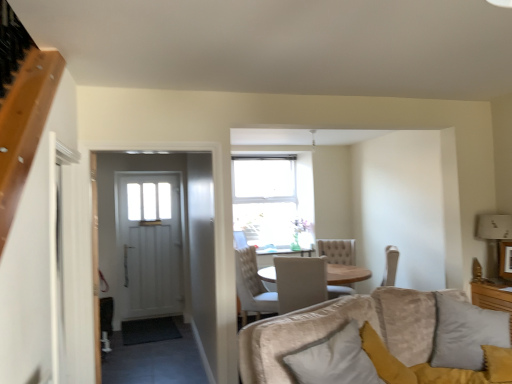
Image resolution: width=512 pixels, height=384 pixels. What do you see at coordinates (334, 360) in the screenshot? I see `white soft pillow at lower right, marked as the 1th pillow in a left-to-right arrangement` at bounding box center [334, 360].

Image resolution: width=512 pixels, height=384 pixels. In order to click on velvet gray pillow at lower right, which ranks as the first pillow in right-to-left order in this screenshot , I will do `click(466, 333)`.

From the image's perspective, which one is positioned lower, white soft pillow at lower right, the second pillow positioned from the right, or white fabric lampshade at upper right?

From the image's view, white soft pillow at lower right, the second pillow positioned from the right, is below.

Who is shorter, white soft pillow at lower right, marked as the 1th pillow in a left-to-right arrangement, or white fabric lampshade at upper right?

With less height is white soft pillow at lower right, marked as the 1th pillow in a left-to-right arrangement.

Is point (329, 358) positioned before point (480, 235)?

Yes.

Could you tell me if white soft pillow at lower right, the second pillow positioned from the right, is turned towards white fabric lampshade at upper right?

No, white soft pillow at lower right, the second pillow positioned from the right, does not turn towards white fabric lampshade at upper right.

From the picture: Which object is positioned more to the right, velvet gray pillow at lower right, which ranks as the 2th pillow in left-to-right order, or white fabric lampshade at upper right?

white fabric lampshade at upper right is more to the right.

How different are the orientations of velvet gray pillow at lower right, which ranks as the 2th pillow in left-to-right order, and white fabric lampshade at upper right in degrees?

The angle between the facing direction of velvet gray pillow at lower right, which ranks as the 2th pillow in left-to-right order, and the facing direction of white fabric lampshade at upper right is 56.8 degrees.

Is point (436, 331) closer or farther from the camera than point (502, 218)?

Point (436, 331) is positioned closer to the camera compared to point (502, 218).

Considering their positions, is velvet gray pillow at lower right, which ranks as the first pillow in right-to-left order, located in front of or behind white fabric lampshade at upper right?

Visually, velvet gray pillow at lower right, which ranks as the first pillow in right-to-left order, is located in front of white fabric lampshade at upper right.

Is velvet gray pillow at lower right, which ranks as the first pillow in right-to-left order, positioned with its back to beige fabric chair at center?

velvet gray pillow at lower right, which ranks as the first pillow in right-to-left order, is not turned away from beige fabric chair at center.

Between velvet gray pillow at lower right, which ranks as the 2th pillow in left-to-right order, and beige fabric chair at center, which one has smaller size?

velvet gray pillow at lower right, which ranks as the 2th pillow in left-to-right order.

From a real-world perspective, between velvet gray pillow at lower right, which ranks as the 2th pillow in left-to-right order, and beige fabric chair at center, who is vertically higher?

In real-world perspective, velvet gray pillow at lower right, which ranks as the 2th pillow in left-to-right order, is above.

Can you tell me how much velvet gray pillow at lower right, which ranks as the first pillow in right-to-left order, and beige fabric chair at center differ in facing direction?

The angle between the facing direction of velvet gray pillow at lower right, which ranks as the first pillow in right-to-left order, and the facing direction of beige fabric chair at center is 87 degrees.

Can you confirm if beige fabric chair at center is smaller than velvet gray pillow at lower right, which ranks as the first pillow in right-to-left order?

Actually, beige fabric chair at center might be larger than velvet gray pillow at lower right, which ranks as the first pillow in right-to-left order.

Is there a large distance between beige fabric chair at center and velvet gray pillow at lower right, which ranks as the 2th pillow in left-to-right order?

beige fabric chair at center is positioned a significant distance from velvet gray pillow at lower right, which ranks as the 2th pillow in left-to-right order.

Locate an element on the screen. The width and height of the screenshot is (512, 384). pillow that is the 2nd object above the beige fabric chair at center (from a real-world perspective) is located at coordinates tap(466, 333).

From a real-world perspective, relative to velvet gray pillow at lower right, which ranks as the 2th pillow in left-to-right order, is beige fabric chair at center vertically above or below?

In terms of real-world spatial position, beige fabric chair at center is below velvet gray pillow at lower right, which ranks as the 2th pillow in left-to-right order.

Could you tell me if white soft pillow at lower right, the second pillow positioned from the right, is facing beige fabric chair at center?

No, white soft pillow at lower right, the second pillow positioned from the right, is not facing towards beige fabric chair at center.

From a real-world perspective, between white soft pillow at lower right, the second pillow positioned from the right, and beige fabric chair at center, who is vertically lower?

beige fabric chair at center is physically lower.

Which of these two, white soft pillow at lower right, marked as the 1th pillow in a left-to-right arrangement, or beige fabric chair at center, is thinner?

white soft pillow at lower right, marked as the 1th pillow in a left-to-right arrangement, is thinner.

From a real-world perspective, relative to white soft pillow at lower right, the second pillow positioned from the right, is white fabric lampshade at upper right vertically above or below?

Clearly, from a real-world perspective, white fabric lampshade at upper right is above white soft pillow at lower right, the second pillow positioned from the right.

Does white fabric lampshade at upper right lie in front of white soft pillow at lower right, marked as the 1th pillow in a left-to-right arrangement?

No, white fabric lampshade at upper right is further to the viewer.

What's the angular difference between white fabric lampshade at upper right and white soft pillow at lower right, marked as the 1th pillow in a left-to-right arrangement,'s facing directions?

white fabric lampshade at upper right and white soft pillow at lower right, marked as the 1th pillow in a left-to-right arrangement, are facing 113 degrees away from each other.

Is white soft pillow at lower right, the second pillow positioned from the right, completely or partially inside white fabric lampshade at upper right?

No, white soft pillow at lower right, the second pillow positioned from the right, is not a part of white fabric lampshade at upper right.

From the picture: Considering the sizes of white soft pillow at lower right, marked as the 1th pillow in a left-to-right arrangement, and velvet gray pillow at lower right, which ranks as the first pillow in right-to-left order, in the image, is white soft pillow at lower right, marked as the 1th pillow in a left-to-right arrangement, bigger or smaller than velvet gray pillow at lower right, which ranks as the first pillow in right-to-left order,?

Considering their sizes, white soft pillow at lower right, marked as the 1th pillow in a left-to-right arrangement, takes up less space than velvet gray pillow at lower right, which ranks as the first pillow in right-to-left order.

Based on the photo, is white soft pillow at lower right, marked as the 1th pillow in a left-to-right arrangement, at the right side of velvet gray pillow at lower right, which ranks as the first pillow in right-to-left order?

No.

Is white soft pillow at lower right, marked as the 1th pillow in a left-to-right arrangement, in front of velvet gray pillow at lower right, which ranks as the 2th pillow in left-to-right order?

That is True.

This screenshot has height=384, width=512. In order to click on lamp that appears above the white soft pillow at lower right, the second pillow positioned from the right (from a real-world perspective) in this screenshot , I will do `click(495, 227)`.

Where is `lamp on the right of the velvet gray pillow at lower right, which ranks as the 2th pillow in left-to-right order`? This screenshot has width=512, height=384. lamp on the right of the velvet gray pillow at lower right, which ranks as the 2th pillow in left-to-right order is located at coordinates (495, 227).

Consider the image. Based on their spatial positions, is white soft pillow at lower right, marked as the 1th pillow in a left-to-right arrangement, or velvet gray pillow at lower right, which ranks as the 2th pillow in left-to-right order, closer to beige fabric chair at center?

velvet gray pillow at lower right, which ranks as the 2th pillow in left-to-right order, is positioned closer to the anchor beige fabric chair at center.

Which object lies further to the anchor point beige fabric chair at center, velvet gray pillow at lower right, which ranks as the first pillow in right-to-left order, or white soft pillow at lower right, marked as the 1th pillow in a left-to-right arrangement?

Among the two, white soft pillow at lower right, marked as the 1th pillow in a left-to-right arrangement, is located further to beige fabric chair at center.

Considering their positions, is beige fabric chair at center positioned closer to velvet gray pillow at lower right, which ranks as the 2th pillow in left-to-right order, than white soft pillow at lower right, the second pillow positioned from the right?

Among the two, white soft pillow at lower right, the second pillow positioned from the right, is located nearer to velvet gray pillow at lower right, which ranks as the 2th pillow in left-to-right order.

From the image, which object appears to be nearer to white soft pillow at lower right, the second pillow positioned from the right, velvet gray pillow at lower right, which ranks as the first pillow in right-to-left order, or white fabric lampshade at upper right?

The object closer to white soft pillow at lower right, the second pillow positioned from the right, is velvet gray pillow at lower right, which ranks as the first pillow in right-to-left order.

Estimate the real-world distances between objects in this image. Which object is closer to velvet gray pillow at lower right, which ranks as the 2th pillow in left-to-right order, white fabric lampshade at upper right or beige fabric chair at center?

white fabric lampshade at upper right is positioned closer to the anchor velvet gray pillow at lower right, which ranks as the 2th pillow in left-to-right order.

Based on the photo, based on their spatial positions, is white fabric lampshade at upper right or beige fabric chair at center further from white soft pillow at lower right, the second pillow positioned from the right?

white fabric lampshade at upper right lies further to white soft pillow at lower right, the second pillow positioned from the right, than the other object.

Based on their spatial positions, is beige fabric chair at center or white fabric lampshade at upper right closer to white soft pillow at lower right, the second pillow positioned from the right?

The object closer to white soft pillow at lower right, the second pillow positioned from the right, is beige fabric chair at center.

Considering their positions, is white soft pillow at lower right, marked as the 1th pillow in a left-to-right arrangement, positioned closer to white fabric lampshade at upper right than velvet gray pillow at lower right, which ranks as the first pillow in right-to-left order?

Based on the image, velvet gray pillow at lower right, which ranks as the first pillow in right-to-left order, appears to be nearer to white fabric lampshade at upper right.

Where is `pillow between white soft pillow at lower right, marked as the 1th pillow in a left-to-right arrangement, and white fabric lampshade at upper right`? This screenshot has height=384, width=512. pillow between white soft pillow at lower right, marked as the 1th pillow in a left-to-right arrangement, and white fabric lampshade at upper right is located at coordinates (466, 333).

You are a GUI agent. You are given a task and a screenshot of the screen. Output one action in this format:
    pyautogui.click(x=<x>, y=<y>)
    Task: Click on the pillow between white soft pillow at lower right, marked as the 1th pillow in a left-to-right arrangement, and beige fabric chair at center, along the z-axis
    The image size is (512, 384).
    Given the screenshot: What is the action you would take?
    pyautogui.click(x=466, y=333)

Locate an element on the screen. The image size is (512, 384). lamp between white soft pillow at lower right, marked as the 1th pillow in a left-to-right arrangement, and beige fabric chair at center, along the z-axis is located at coordinates (495, 227).

Identify the location of lamp located between velvet gray pillow at lower right, which ranks as the first pillow in right-to-left order, and beige fabric chair at center in the depth direction. (495, 227).